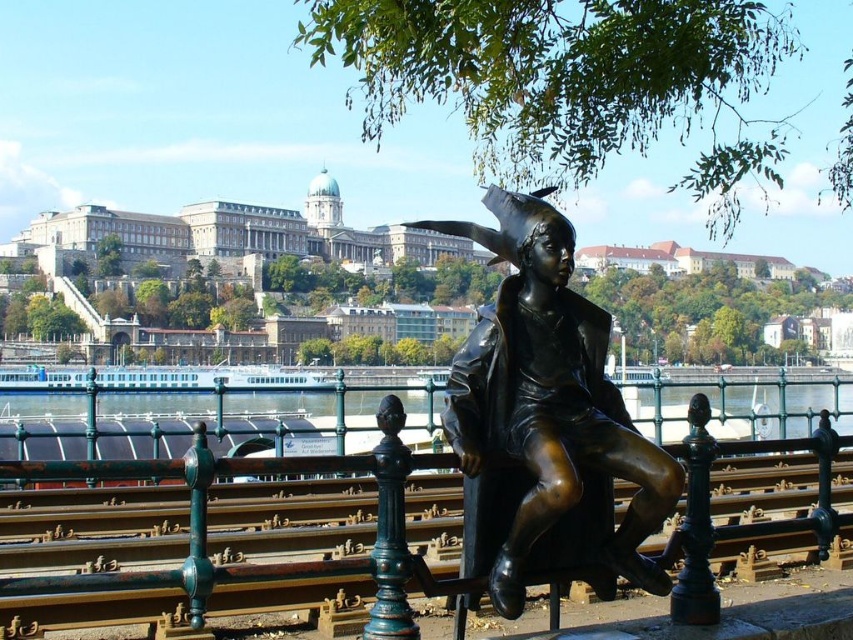
You are an architect designing a new pathway that needs to pass between the bronze at center and the bronze statue at center. The pathway must be at least 2 meters wide. Can the pathway fit between them based on their widths?

The bronze at center is wider than the bronze statue at center, but the exact widths aren not provided. Therefore, it is impossible to determine if the 2 meter pathway can fit between them without additional measurements.